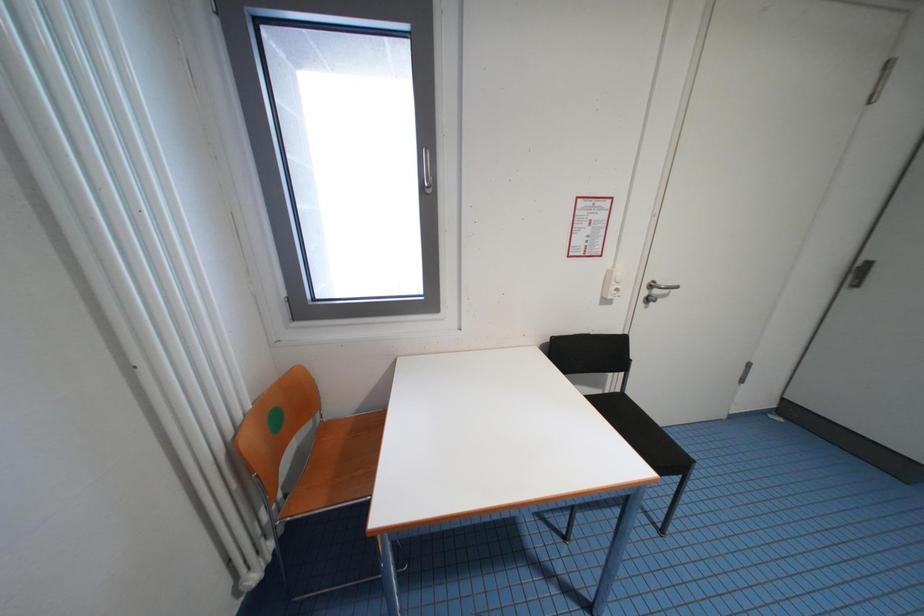
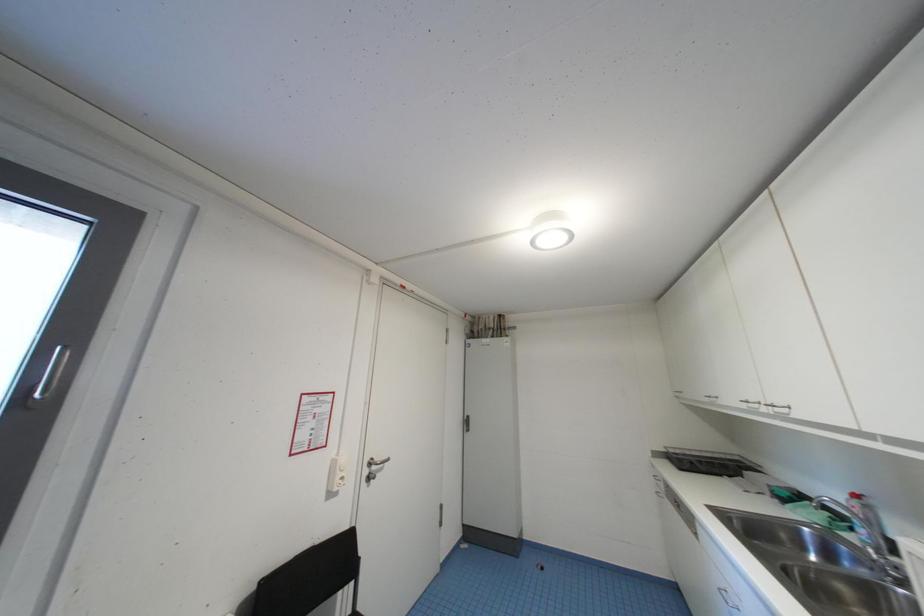
The first image is from the beginning of the video and the second image is from the end. How did the camera likely rotate when shooting the video?

The camera rotated toward right-up.